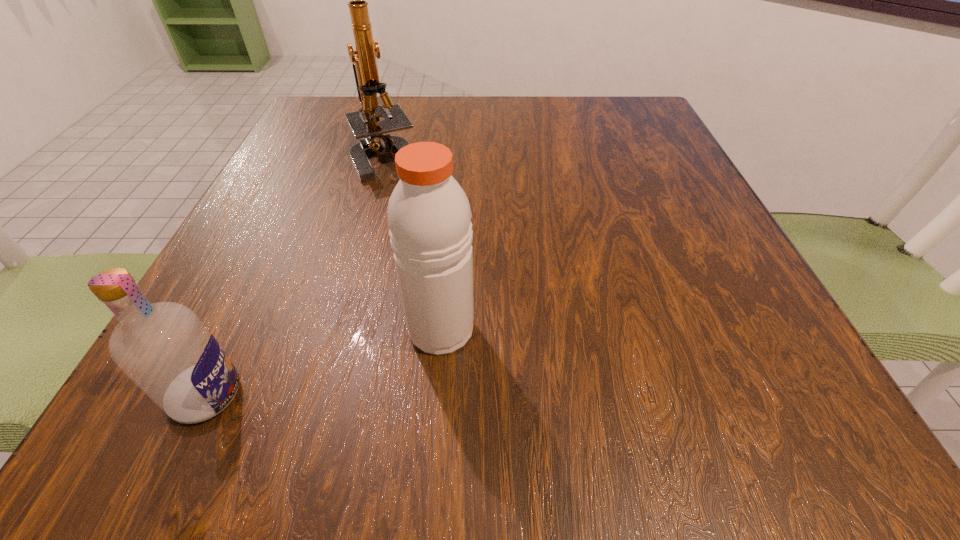
Find the location of a particular element. The height and width of the screenshot is (540, 960). the farthest object is located at coordinates (365, 123).

The width and height of the screenshot is (960, 540). Identify the location of microscope. (365, 123).

Image resolution: width=960 pixels, height=540 pixels. Identify the location of the rightmost object. pyautogui.click(x=429, y=216).

Locate an element on the screen. The image size is (960, 540). the second farthest object is located at coordinates (429, 216).

The width and height of the screenshot is (960, 540). In order to click on the leftmost object in this screenshot , I will do (163, 347).

Find the location of `vodka`. vodka is located at coordinates (163, 347).

Image resolution: width=960 pixels, height=540 pixels. Find the location of `vacant space situated 0.050m at the eyepiece of the second object from right to left`. vacant space situated 0.050m at the eyepiece of the second object from right to left is located at coordinates (376, 199).

In order to click on free space located 0.270m on the right of the rightmost object in this screenshot , I will do `click(675, 329)`.

Where is `vacant area located 0.170m on the label of the nearest object`? vacant area located 0.170m on the label of the nearest object is located at coordinates (383, 395).

This screenshot has width=960, height=540. In order to click on object situated at the far edge in this screenshot , I will do `click(365, 123)`.